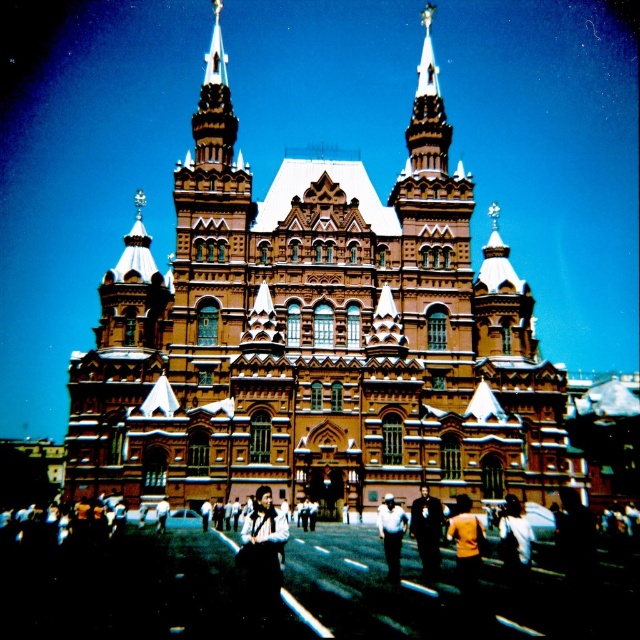
You are standing on the street in front of the grand building. You see two people wearing an orange shirt at center and a white shirt at center. Which one is positioned more to the left side?

The orange shirt at center is positioned to the left of the white shirt at center, so the orange shirt at center is more to the left side.

You are an architect visiting this building and want to compare the height of the gold ornate spire at upper center and the white cotton shirt at center. Which one is taller?

The gold ornate spire at upper center is taller than the white cotton shirt at center.

You are standing at the entrance of the grand ornate building with multiple towers and want to find someone wearing an orange shirt at center. According to the image, where would you look relative to the building?

The orange shirt at center is located at the center of the image, so you should look towards the central area in front of the grand ornate building.